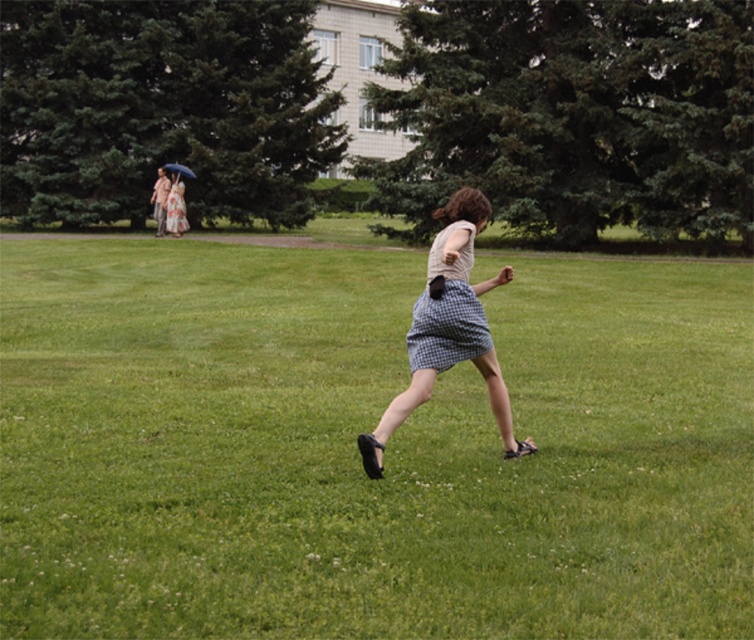
You are a fashion designer observing two checkered fabric items in the scene. Which one is taller between the checkered fabric skirt at center and the checkered fabric dress at center?

The checkered fabric skirt at center is much taller than the checkered fabric dress at center.

You are standing at the point with coordinates point (x=463, y=292) and want to walk towards the point with coordinates point (x=434, y=320). Which direction should you move relative to the other point?

You should move forward towards point (x=434, y=320) because it is in front of point (x=463, y=292).

You are a photographer trying to capture a photo of the person in the matte white dress at upper left and the green grass at center. Based on their positions, which object is closer to the camera?

The matte white dress at upper left is closer to the camera because it is positioned above the green grass at center, which is located below it.